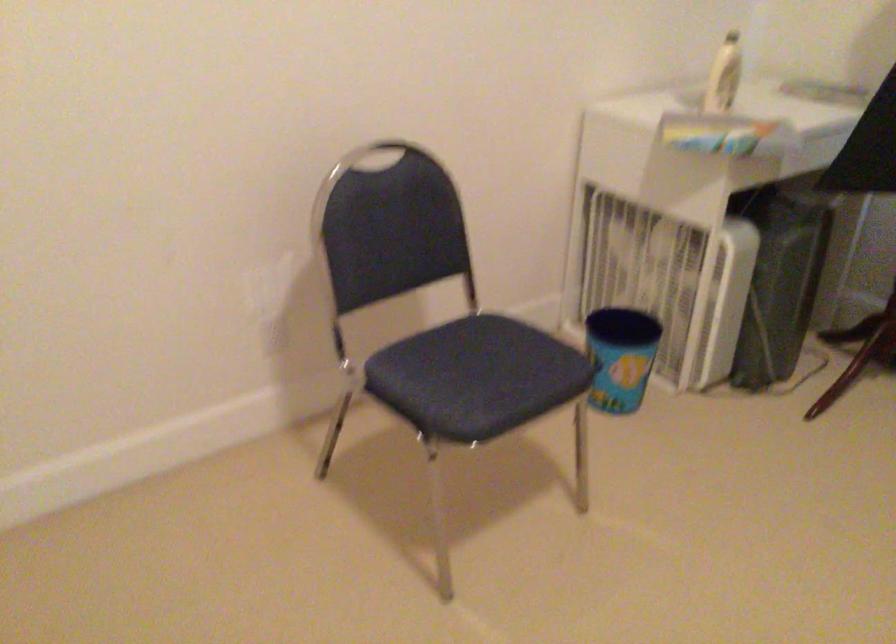
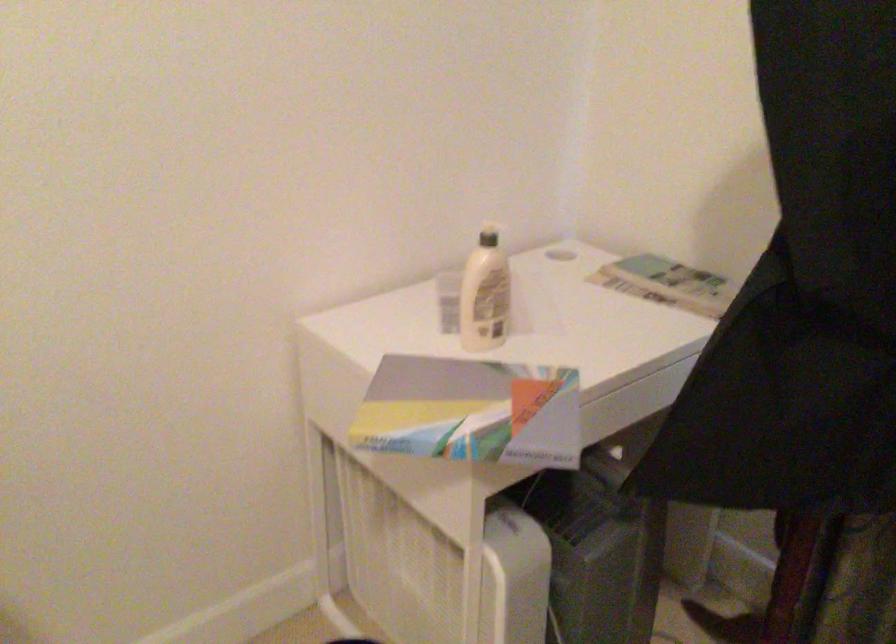
Which direction would the cameraman need to move to produce the second image?

The movement direction of the cameraman is right, forward.